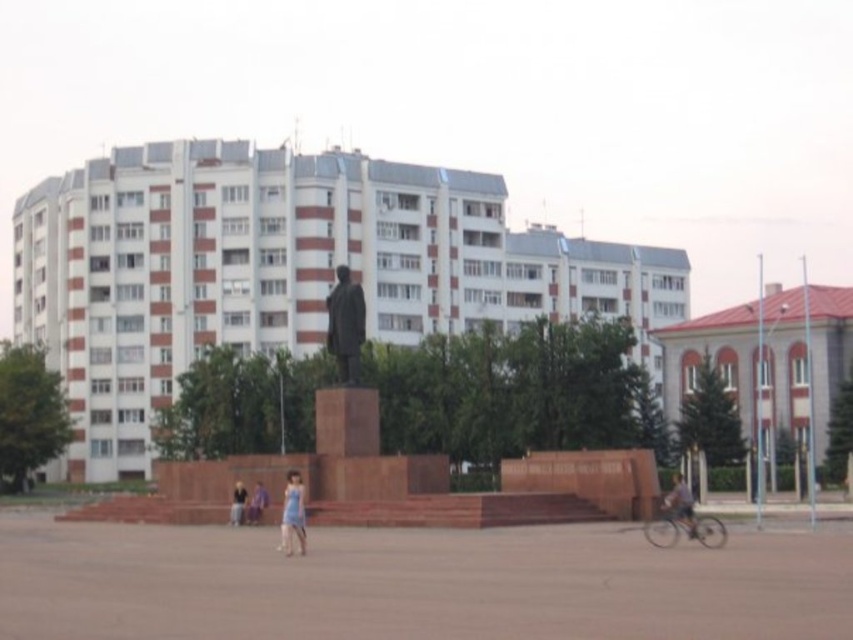
Does blue fabric dress at lower center have a greater width compared to blue dress at center?

Yes, blue fabric dress at lower center is wider than blue dress at center.

Does blue fabric dress at lower center appear over blue dress at center?

Indeed, blue fabric dress at lower center is positioned over blue dress at center.

Find the location of `blue fabric dress at lower center`. blue fabric dress at lower center is located at coordinates (293, 513).

Who is positioned more to the right, blue dress at center or light blue dress at center?

blue dress at center is more to the right.

In the scene shown: Does blue dress at center have a greater width compared to light blue dress at center?

Correct, the width of blue dress at center exceeds that of light blue dress at center.

Between point (258, 513) and point (231, 524), which one is positioned in front?

Positioned in front is point (258, 513).

You are a GUI agent. You are given a task and a screenshot of the screen. Output one action in this format:
    pyautogui.click(x=<x>, y=<y>)
    Task: Click on the blue dress at center
    Image resolution: width=853 pixels, height=640 pixels.
    Given the screenshot: What is the action you would take?
    (x=257, y=502)

Can you confirm if blue fabric dress at lower center is positioned to the right of blue denim shorts at lower right?

Answer: Incorrect, blue fabric dress at lower center is not on the right side of blue denim shorts at lower right.

Is point (286, 534) more distant than point (683, 518)?

That is False.

Where is `blue fabric dress at lower center`? The width and height of the screenshot is (853, 640). blue fabric dress at lower center is located at coordinates (293, 513).